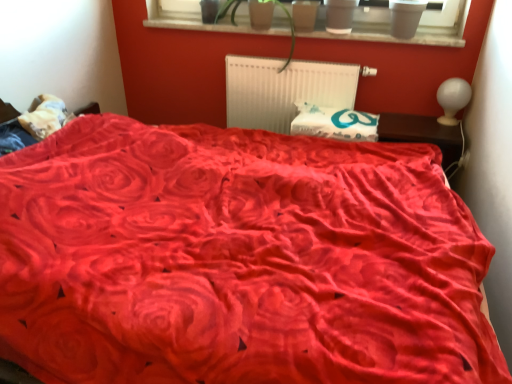
Identify the location of vacant area situated below matte gray flowerpot at upper center, marked as the 2th flowerpot in a left-to-right arrangement (from a real-world perspective). This screenshot has height=384, width=512. (338, 30).